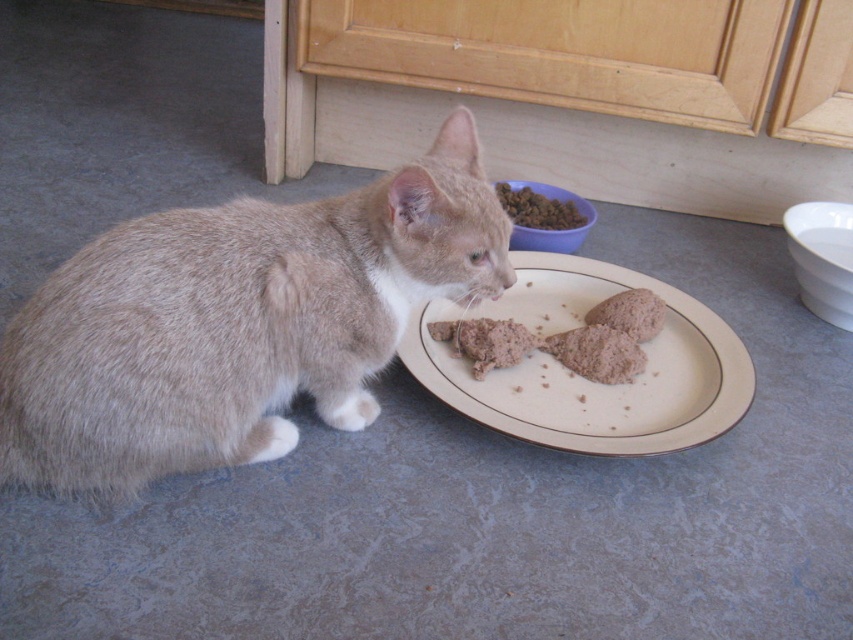
Who is lower down, brown crumbly food at center or dry kibble at upper center?

Positioned lower is brown crumbly food at center.

Locate an element on the screen. brown crumbly food at center is located at coordinates (630, 314).

Between point (689, 269) and point (527, 218), which one is positioned behind?

The point (527, 218) is more distant.

Is soft fur cat at lower left to the right of dry kibble at upper center from the viewer's perspective?

Correct, you'll find soft fur cat at lower left to the right of dry kibble at upper center.

Is point (740, 634) less distant than point (556, 202)?

That is True.

Find the location of `soft fur cat at lower left`. soft fur cat at lower left is located at coordinates (491, 506).

The image size is (853, 640). Describe the element at coordinates (236, 323) in the screenshot. I see `gray fur cat at left` at that location.

Is gray fur cat at left positioned behind brown textured food at plate center?

That is False.

Is point (461, 177) more distant than point (625, 326)?

No, it is in front of (625, 326).

Where is `gray fur cat at left`? The height and width of the screenshot is (640, 853). gray fur cat at left is located at coordinates (236, 323).